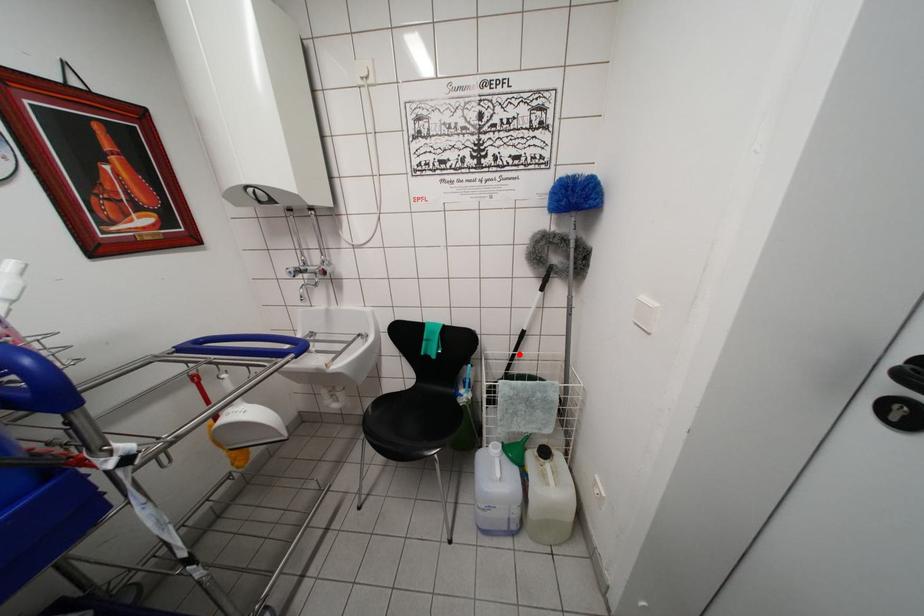
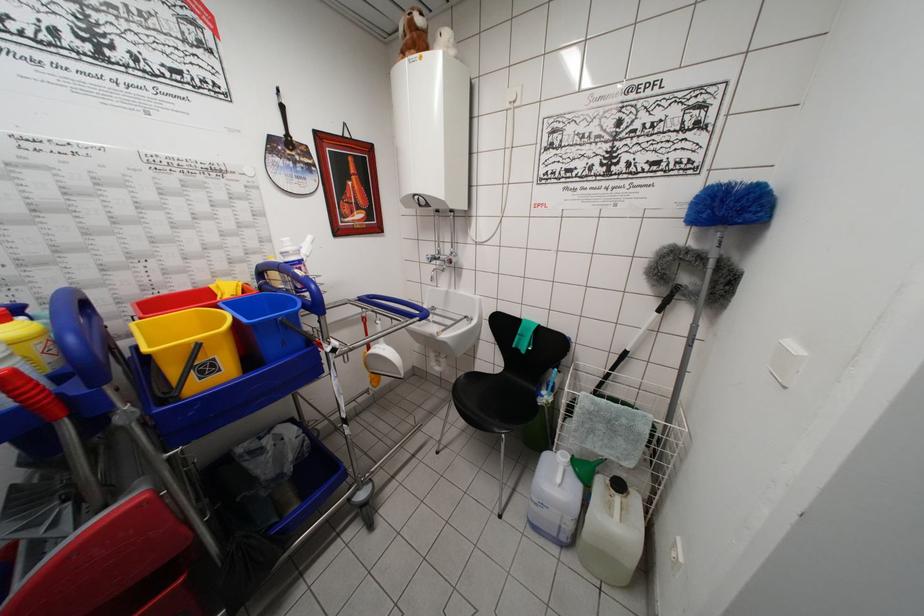
Question: I am providing you with two images of the same scene from different viewpoints. A red point is shown in image1. For the corresponding object point in image2, is it positioned nearer or farther from the camera?

Choices:
 (A) Nearer
 (B) Farther

Answer: (A)